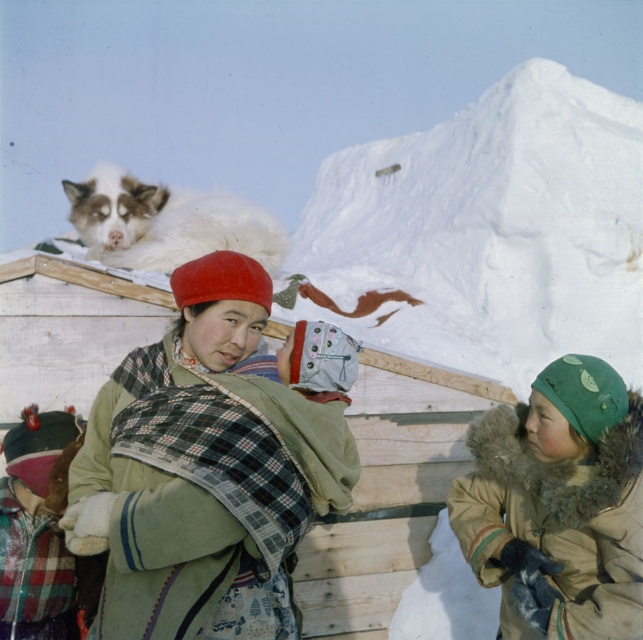
Which is more to the right, white fluffy cat at upper left or plaid fabric baby carrier at center?

From the viewer's perspective, plaid fabric baby carrier at center appears more on the right side.

Is point (203, 225) closer to camera compared to point (14, 440)?

No, (203, 225) is behind (14, 440).

The width and height of the screenshot is (643, 640). What are the coordinates of `white fluffy cat at upper left` in the screenshot? It's located at (167, 224).

Is green fur-lined coat at lower right thinner than white fluffy cat at upper left?

Correct, green fur-lined coat at lower right's width is less than white fluffy cat at upper left's.

Who is higher up, green fur-lined coat at lower right or white fluffy cat at upper left?

white fluffy cat at upper left is higher up.

Which is behind, point (496, 488) or point (159, 243)?

Point (159, 243)

This screenshot has width=643, height=640. Find the location of `green fur-lined coat at lower right`. green fur-lined coat at lower right is located at coordinates (557, 506).

Which is more to the left, green woolen scarf at center or green fur-lined coat at lower right?

Positioned to the left is green woolen scarf at center.

Does point (246, 394) come behind point (584, 616)?

No, (246, 394) is closer to viewer.

Is point (352, 474) behind point (620, 525)?

No, it is in front of (620, 525).

The width and height of the screenshot is (643, 640). I want to click on green woolen scarf at center, so click(203, 468).